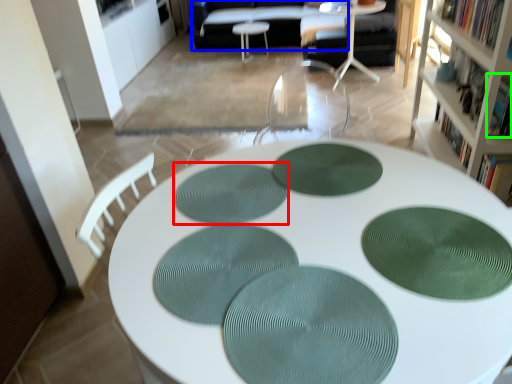
Question: Estimate the real-world distances between objects in this image. Which object is farther from mat (highlighted by a red box), couch (highlighted by a blue box) or book (highlighted by a green box)?

Choices:
 (A) couch
 (B) book

Answer: (A)